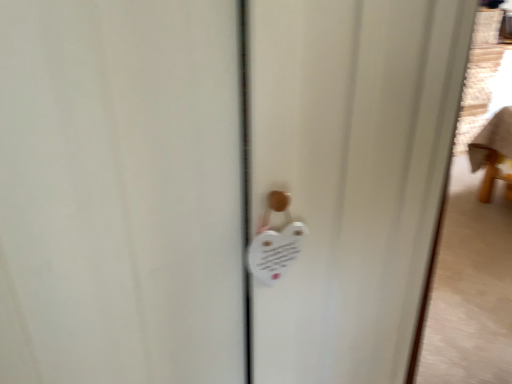
Question: From a real-world perspective, is white matte heart-shaped magnet at center below white plastic lock at center?

Choices:
 (A) no
 (B) yes

Answer: (B)

Question: Does white matte heart-shaped magnet at center have a lesser width compared to white plastic lock at center?

Choices:
 (A) no
 (B) yes

Answer: (A)

Question: Is white matte heart-shaped magnet at center positioned with its back to white plastic lock at center?

Choices:
 (A) no
 (B) yes

Answer: (A)

Question: Is white matte heart-shaped magnet at center closer to the viewer compared to white plastic lock at center?

Choices:
 (A) yes
 (B) no

Answer: (B)

Question: Does white matte heart-shaped magnet at center have a larger size compared to white plastic lock at center?

Choices:
 (A) no
 (B) yes

Answer: (B)

Question: Can we say white matte heart-shaped magnet at center lies outside white plastic lock at center?

Choices:
 (A) no
 (B) yes

Answer: (B)

Question: From a real-world perspective, is white plastic lock at center below white matte heart-shaped magnet at center?

Choices:
 (A) yes
 (B) no

Answer: (B)

Question: Does white plastic lock at center appear on the left side of white matte heart-shaped magnet at center?

Choices:
 (A) yes
 (B) no

Answer: (A)

Question: Does white plastic lock at center have a smaller size compared to white matte heart-shaped magnet at center?

Choices:
 (A) yes
 (B) no

Answer: (A)

Question: Does white plastic lock at center have a greater height compared to white matte heart-shaped magnet at center?

Choices:
 (A) yes
 (B) no

Answer: (A)

Question: Does white plastic lock at center have a lesser height compared to white matte heart-shaped magnet at center?

Choices:
 (A) yes
 (B) no

Answer: (B)

Question: Is white plastic lock at center further to camera compared to white matte heart-shaped magnet at center?

Choices:
 (A) yes
 (B) no

Answer: (B)

Question: Considering their positions, is white plastic lock at center located in front of or behind white matte heart-shaped magnet at center?

Choices:
 (A) behind
 (B) front

Answer: (B)